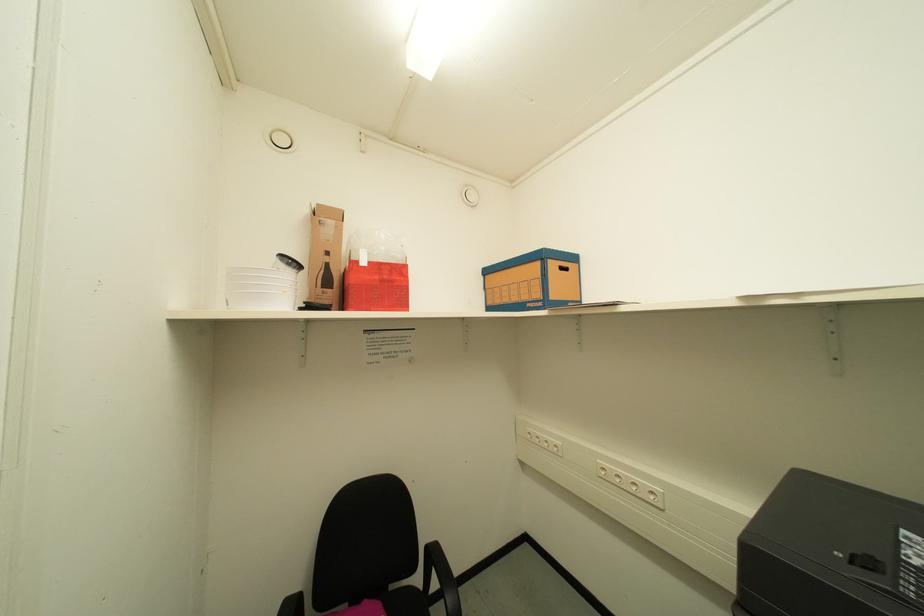
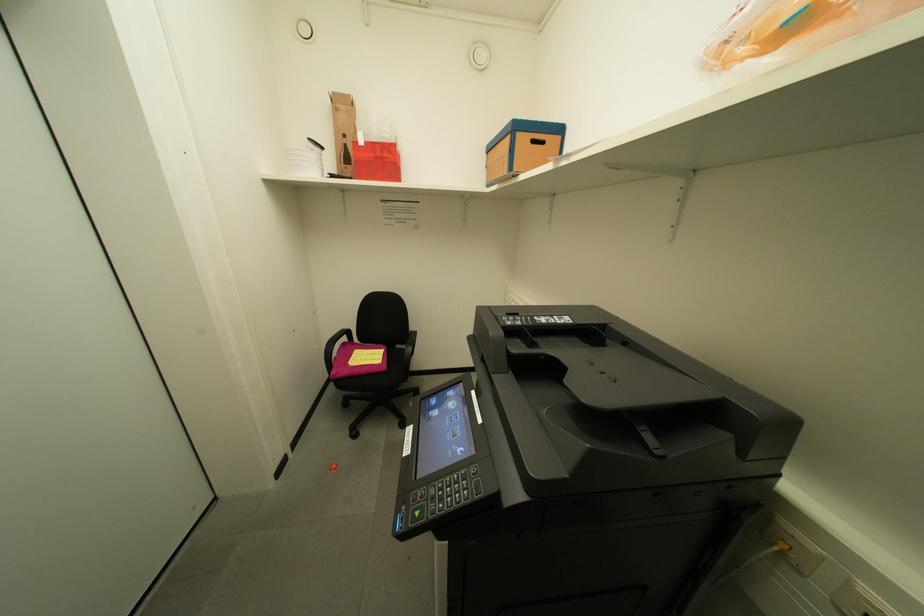
Based on the continuous images, in which direction is the camera rotating?

The camera rotated toward left-down.